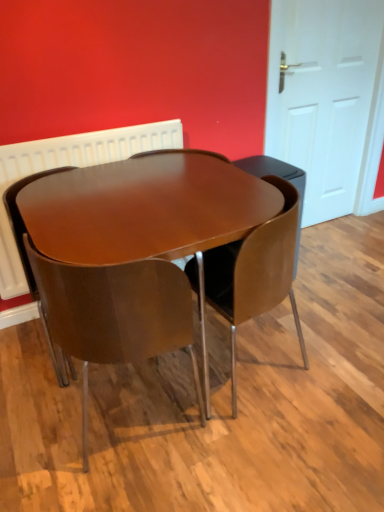
Where is `vacant area to the right of glossy wood table at center`? The width and height of the screenshot is (384, 512). vacant area to the right of glossy wood table at center is located at coordinates (331, 332).